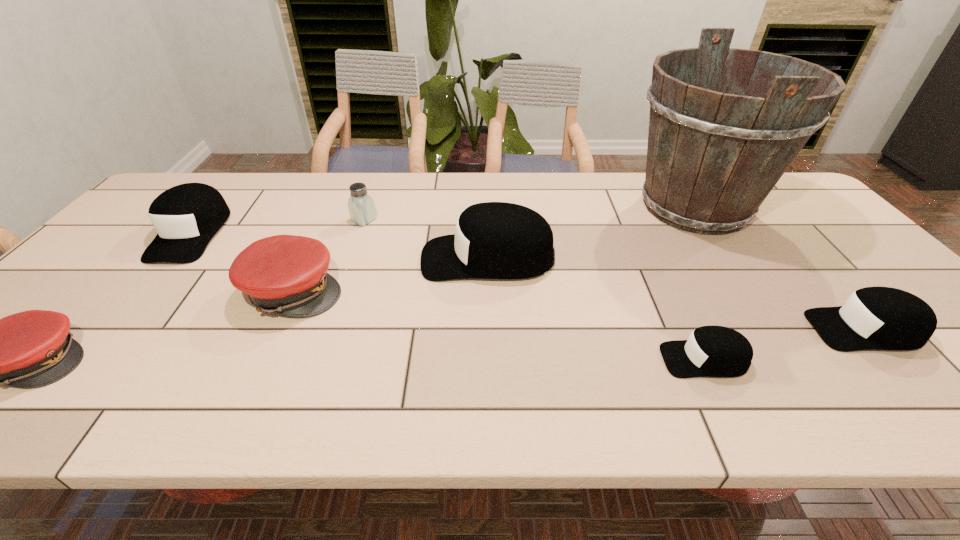
Where is `object that stands as the fifth closest to the nearer red cap`? object that stands as the fifth closest to the nearer red cap is located at coordinates (711, 351).

Locate which object is the closest to the farther red cap. Please provide its 2D coordinates. Your answer should be formatted as a tuple, i.e. [(x, y)], where the tuple contains the x and y coordinates of a point satisfying the conditions above.

[(361, 206)]

The width and height of the screenshot is (960, 540). I want to click on cap that can be found as the sixth closest to the saltshaker, so (873, 318).

This screenshot has height=540, width=960. Identify the location of cap that is the fourth closest one to the third black cap from right to left. (187, 216).

Locate an element on the screen. black cap object that ranks as the third closest to the seventh shortest object is located at coordinates (187, 216).

Point out which black cap is positioned as the fourth nearest to the left red cap. Please provide its 2D coordinates. Your answer should be formatted as a tuple, i.e. [(x, y)], where the tuple contains the x and y coordinates of a point satisfying the conditions above.

[(873, 318)]